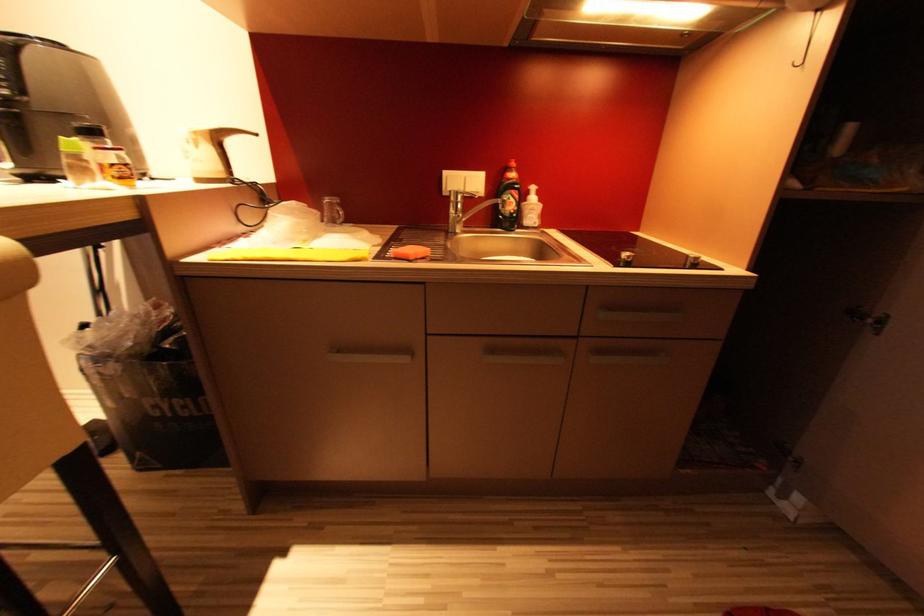
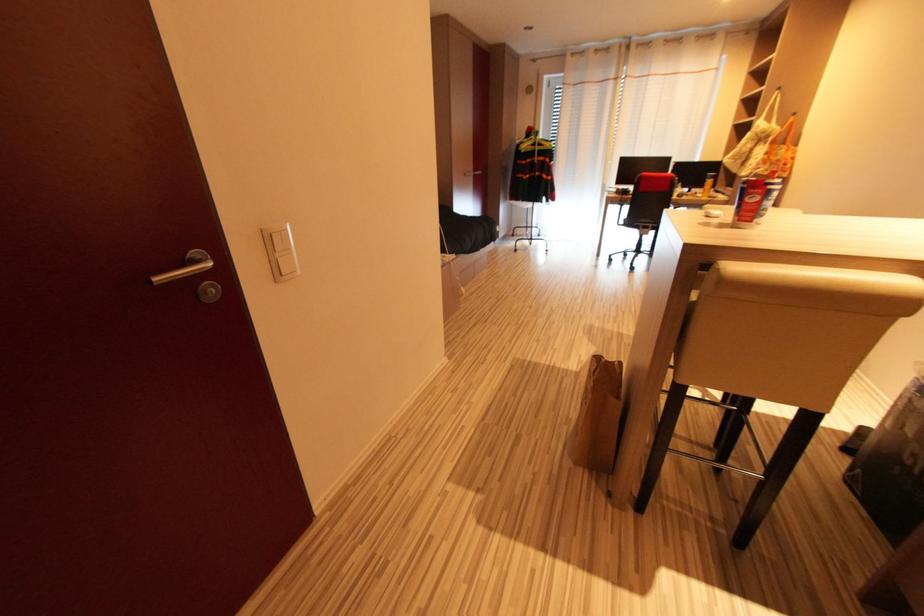
Based on the continuous images, in which direction is the camera rotating?

The rotation direction of the camera is left-down.